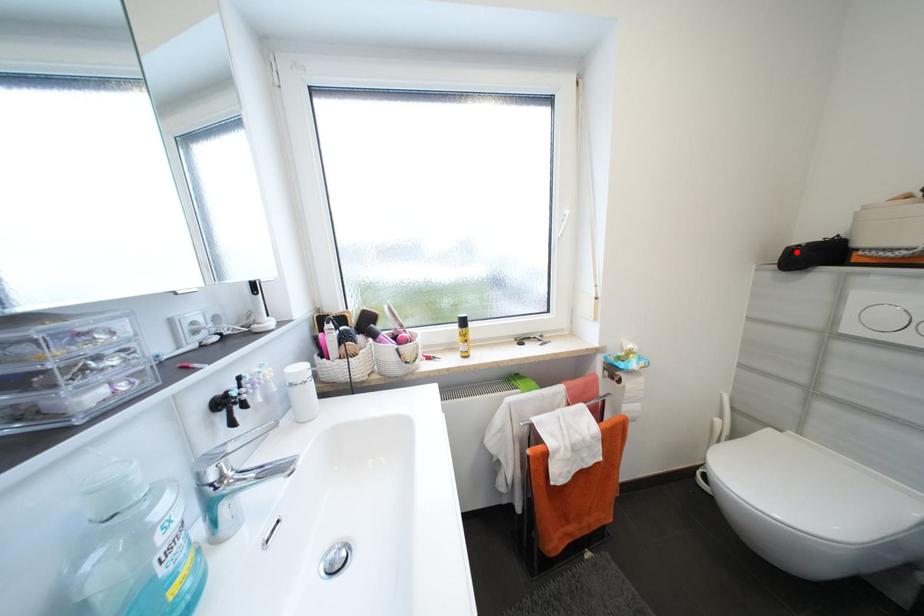
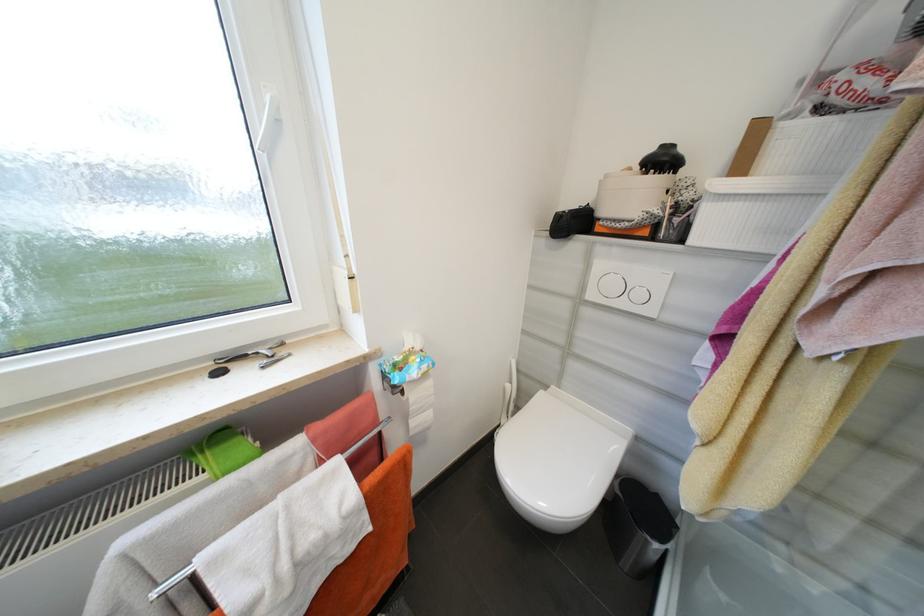
Question: I am providing you with two images of the same scene from different viewpoints. In image1, a red point is highlighted. Considering the same 3D point in image2, which of the following is correct?

Choices:
 (A) It is closer
 (B) It is farther

Answer: (A)